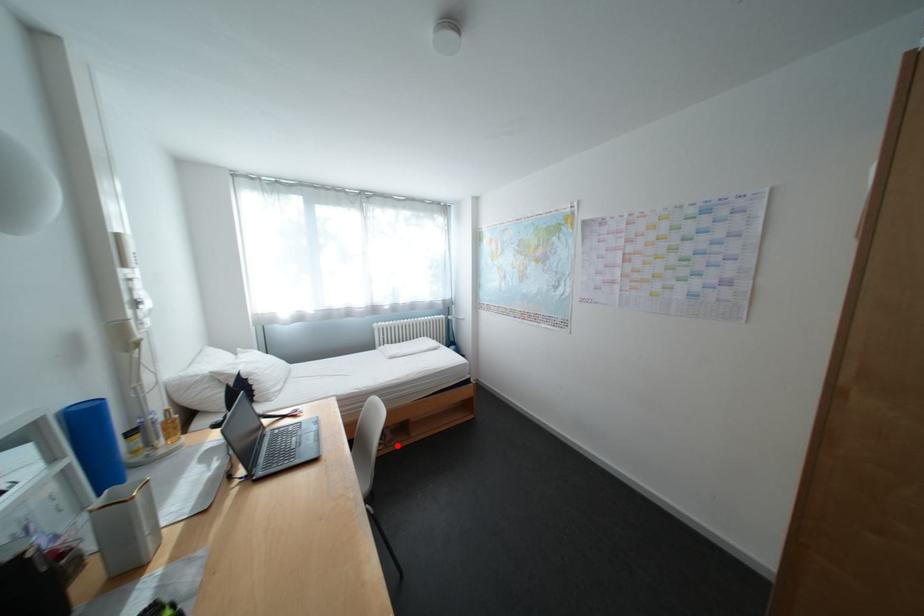
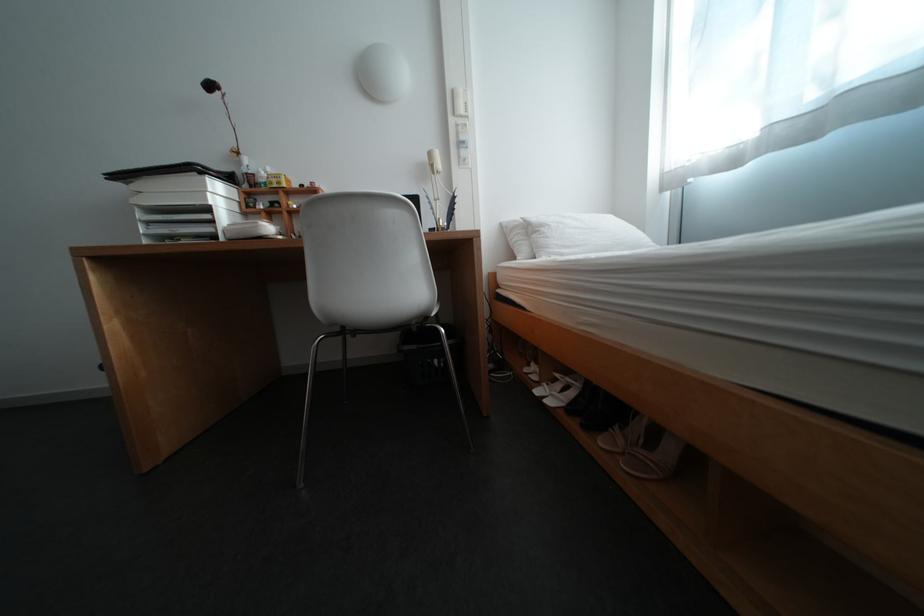
Question: I am providing you with two images of the same scene from different viewpoints. Image1 has a red point marked. In image2, the corresponding 3D location appears at what relative position? Reply with the corresponding letter.

Choices:
 (A) Closer
 (B) Farther

Answer: (A)